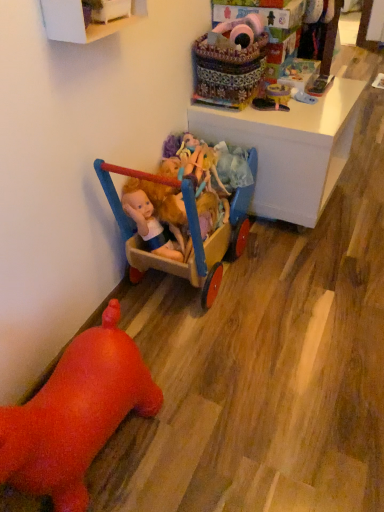
Question: Would you say rubber duck at lower left, which is the first toy in bottom-to-top order, is inside or outside brightly colored fabric basket at upper center?

Choices:
 (A) outside
 (B) inside

Answer: (A)

Question: In the image, is rubber duck at lower left, the 6th toy when ordered from top to bottom, positioned in front of or behind brightly colored fabric basket at upper center?

Choices:
 (A) front
 (B) behind

Answer: (A)

Question: Estimate the real-world distances between objects in this image. Which object is farther from the rubber duck at lower left, the 6th toy when ordered from top to bottom?

Choices:
 (A) black rubber shoe at upper right, acting as the third toy starting from the top
 (B) white painted wood cabinet at upper left
 (C) white glossy desk at upper center
 (D) matte plastic toy at upper center, which appears as the second toy when viewed from the top
 (E) wooden cart at center, which is counted as the 5th toy, starting from the top

Answer: (D)

Question: Estimate the real-world distances between objects in this image. Which object is closer to the white glossy desk at upper center?

Choices:
 (A) matte plastic doll at center, the 3th toy when ordered from bottom to top
 (B) wooden cart at center, which is counted as the 5th toy, starting from the top
 (C) fluffy pink plush at upper center, acting as the 1th toy starting from the top
 (D) matte plastic toy at upper center, which appears as the second toy when viewed from the top
 (E) rubber duck at lower left, the 6th toy when ordered from top to bottom

Answer: (A)